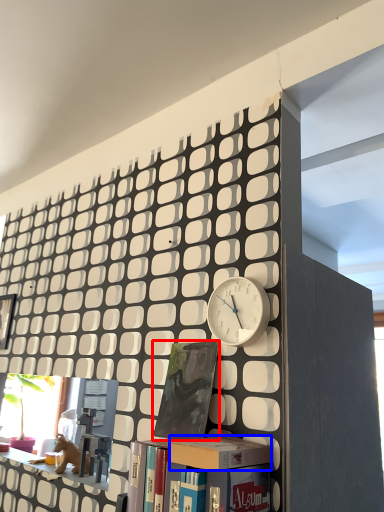
Question: Which point is further to the camera, book (highlighted by a red box) or box (highlighted by a blue box)?

Choices:
 (A) book
 (B) box

Answer: (A)